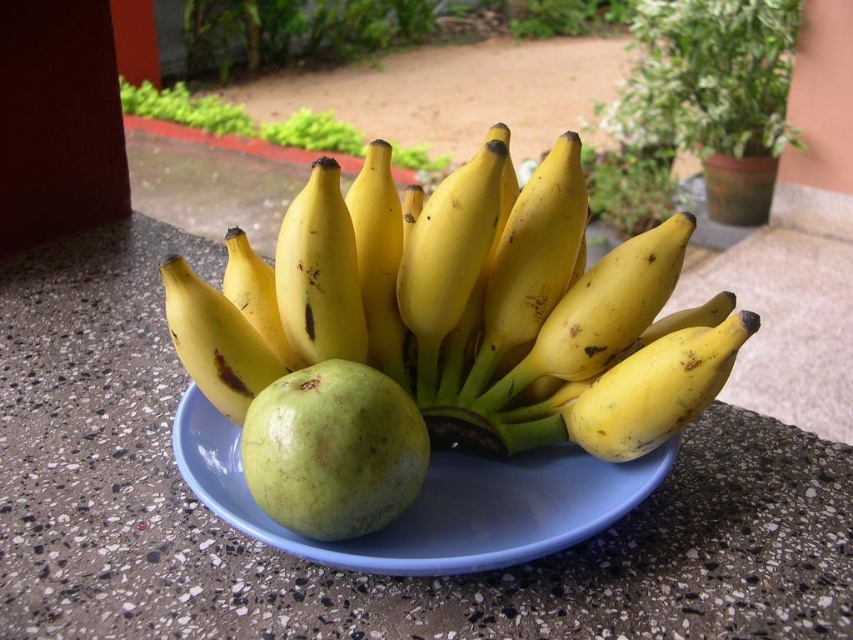
Can you confirm if smooth concrete countertop at center is positioned below blue plastic plate at center?

No, smooth concrete countertop at center is not below blue plastic plate at center.

Who is positioned more to the right, smooth concrete countertop at center or blue plastic plate at center?

blue plastic plate at center

Is point (42, 572) farther from camera compared to point (509, 476)?

No.

This screenshot has width=853, height=640. In order to click on smooth concrete countertop at center in this screenshot , I will do `click(343, 570)`.

Can you confirm if yellow matte bananas at center is positioned to the right of green matte apple at center?

Yes, yellow matte bananas at center is to the right of green matte apple at center.

Describe the element at coordinates (465, 307) in the screenshot. I see `yellow matte bananas at center` at that location.

Between point (392, 259) and point (286, 524), which one is positioned in front?

Positioned in front is point (286, 524).

Where is `yellow matte bananas at center`? The height and width of the screenshot is (640, 853). yellow matte bananas at center is located at coordinates (465, 307).

Is blue plastic plate at center positioned in front of green matte apple at center?

Yes, blue plastic plate at center is in front of green matte apple at center.

Is blue plastic plate at center taller than green matte apple at center?

No, blue plastic plate at center is not taller than green matte apple at center.

Who is more distant from viewer, (483,509) or (389,394)?

The point (483,509) is behind.

Find the location of a particular element. The height and width of the screenshot is (640, 853). blue plastic plate at center is located at coordinates (433, 500).